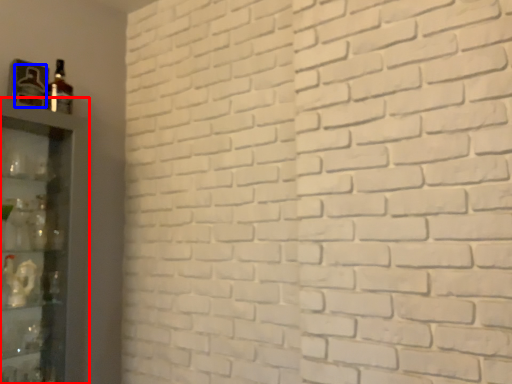
Question: Which object appears closest to the camera in this image, shelf (highlighted by a red box) or bottle (highlighted by a blue box)?

Choices:
 (A) shelf
 (B) bottle

Answer: (A)